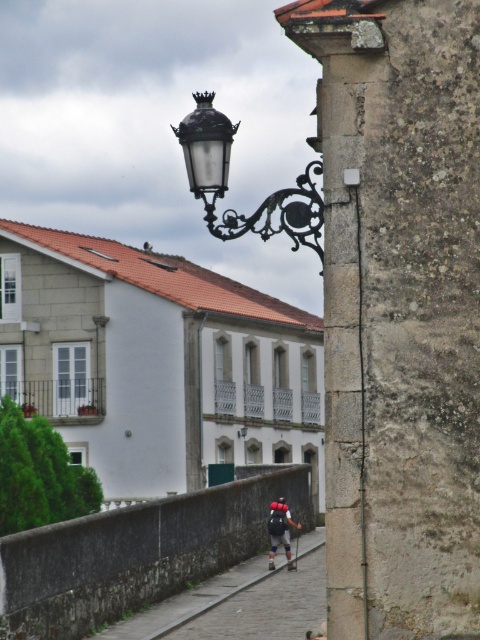
You are a tourist navigating the cobblestone path and want to take a photo of the white stone building at upper left without the matte black backpack at center blocking the view. Is the backpack in the way?

The white stone building at upper left is positioned over the matte black backpack at center, so the backpack is blocking the view of the building. Move forward to get a clear shot.

You are standing at the starting point of the cobblestone path and want to reach the white stone building at upper left. Based on the coordinates provided in the description, is the building to your left or right side?

The white stone building at upper left is located at coordinates point (156,362), which places it to your left side as you face the direction of the path.